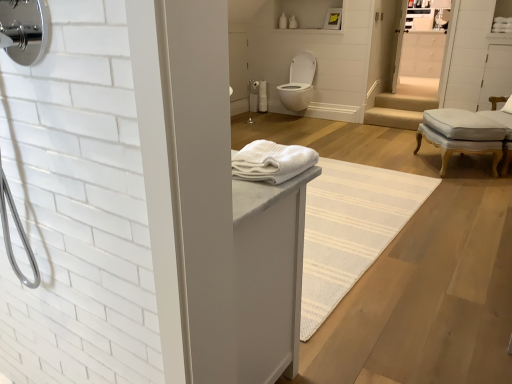
Question: Is white glossy toilet at center taller or shorter than light gray fabric ottoman at right?

Choices:
 (A) tall
 (B) short

Answer: (A)

Question: Is white glossy toilet at center situated inside light gray fabric ottoman at right or outside?

Choices:
 (A) inside
 (B) outside

Answer: (B)

Question: Which object is positioned closest to the matte white shower at center?

Choices:
 (A) white soft towel at center
 (B) light gray fabric ottoman at right
 (C) white matte cabinet at upper right
 (D) white glossy toilet at center

Answer: (D)

Question: Estimate the real-world distances between objects in this image. Which object is farther from the light gray fabric ottoman at right?

Choices:
 (A) white glossy toilet at center
 (B) white matte cabinet at upper right
 (C) matte white shower at center
 (D) white soft towel at center

Answer: (C)